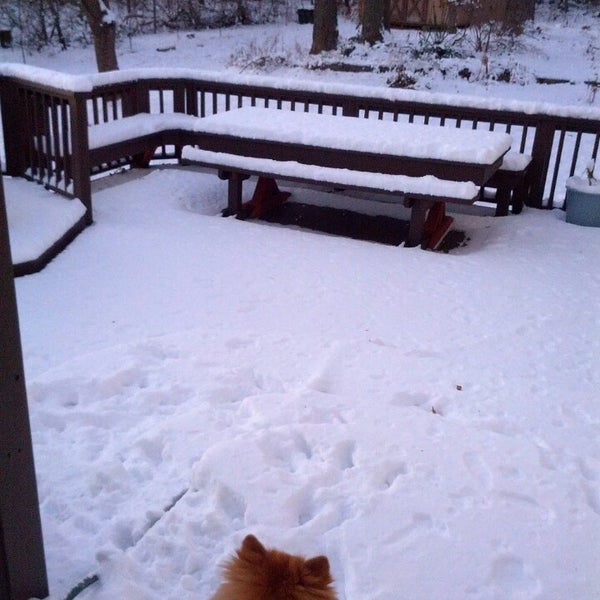
You are a GUI agent. You are given a task and a screenshot of the screen. Output one action in this format:
    pyautogui.click(x=<x>, y=<y>)
    Task: Click on the below table
    
    Given the screenshot: What is the action you would take?
    338,223